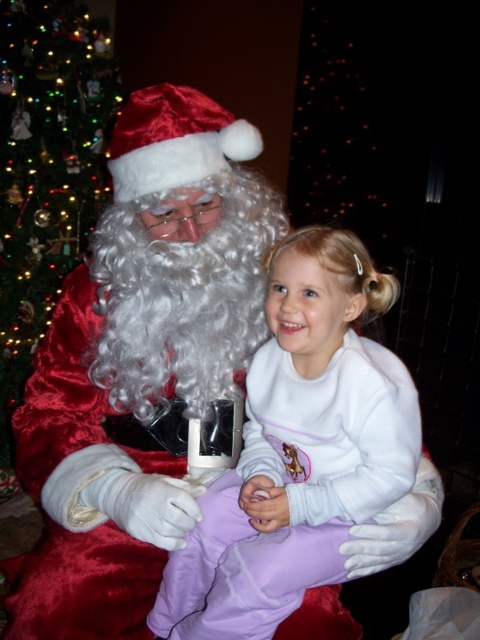
You are a toy delivery robot with a 2 meter long box. You need to move the white fleece onesie at center to the green velvet christmas tree at left. Is there enough space between them to place the box without moving either object?

The white fleece onesie at center and green velvet christmas tree at left are 1.93 meters apart, so the 2 meter long box will not fit between them since the distance is slightly less than the box length.

You are a photographer planning to take a picture of the white fleece onesie at center and the green velvet christmas tree at left. Which object should you focus on if you want the one with the smaller size to be sharp?

The white fleece onesie at center has a smaller size compared to the green velvet christmas tree at left, so you should focus on the white fleece onesie at center to ensure it appears sharp in the photograph.